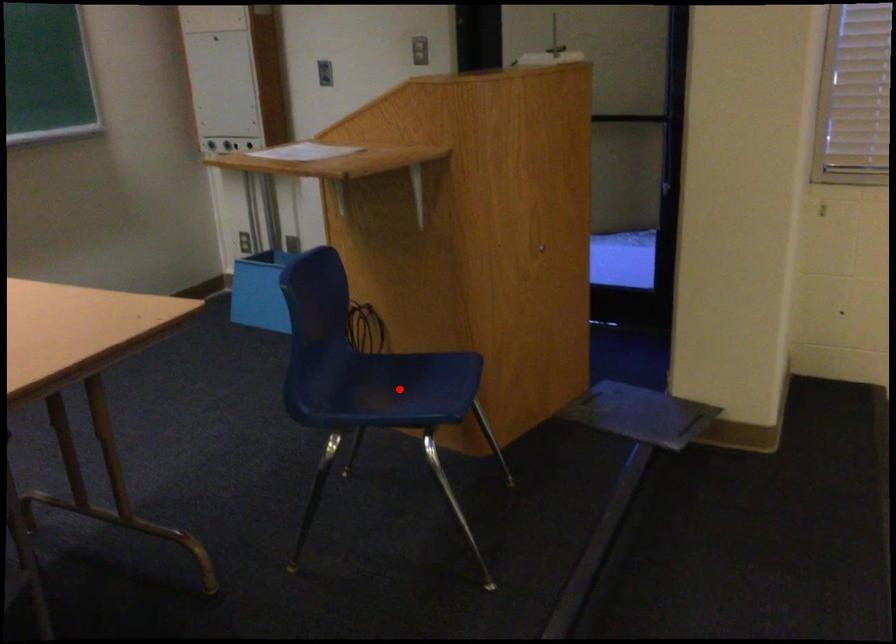
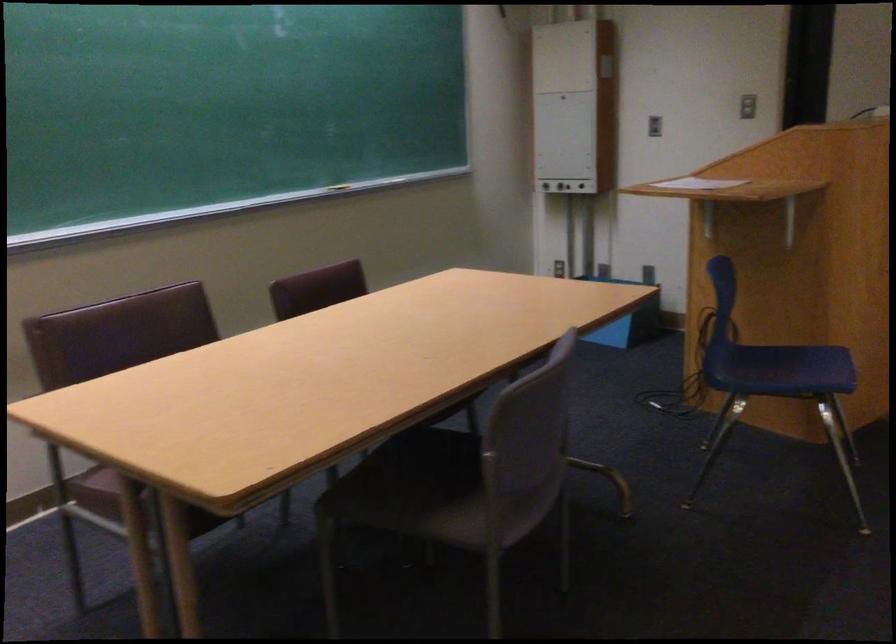
Find the pixel in the second image that matches the highlighted location in the first image.

(782, 368)